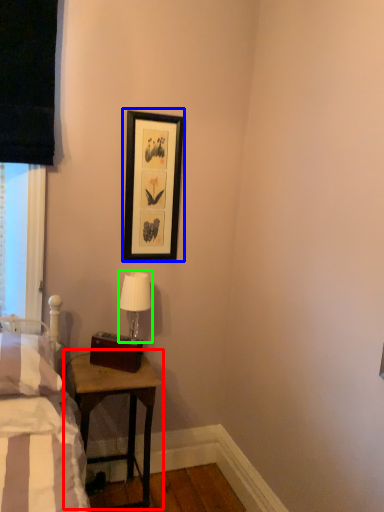
Question: Which object is the closest to the table (highlighted by a red box)? Choose among these: picture frame (highlighted by a blue box) or table lamp (highlighted by a green box).

Choices:
 (A) picture frame
 (B) table lamp

Answer: (B)